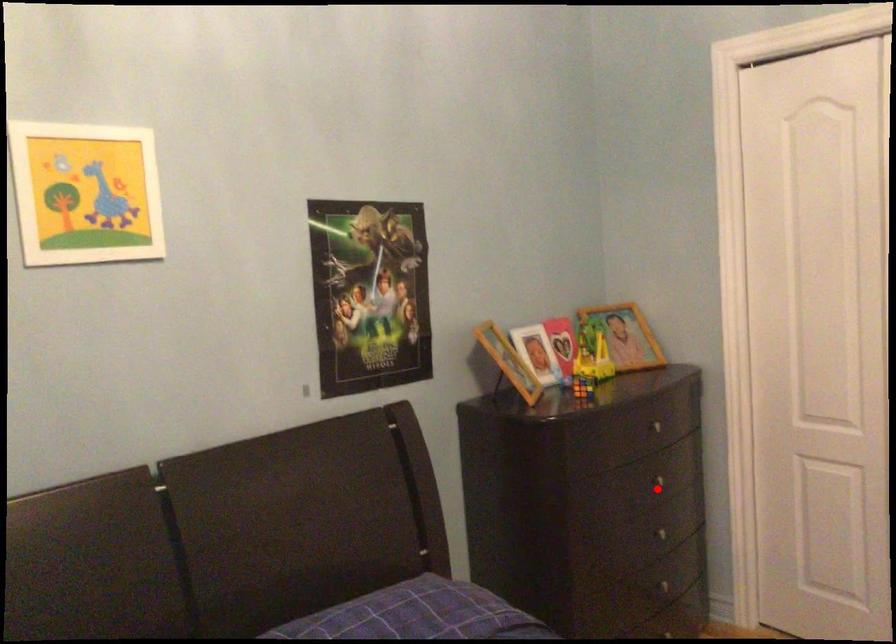
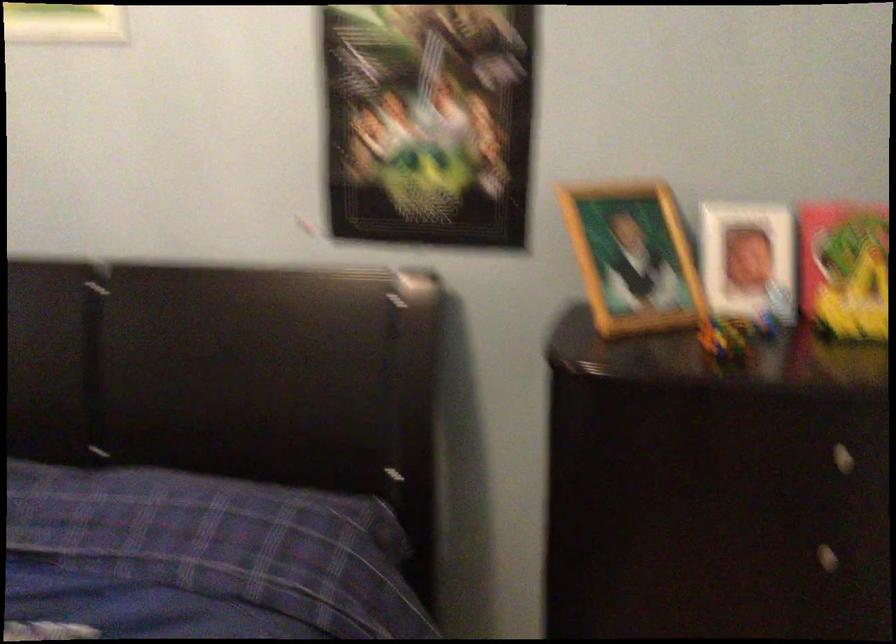
Question: I am providing you with two images of the same scene from different viewpoints. In image1, a red point is highlighted. Considering the same 3D point in image2, which of the following is correct?

Choices:
 (A) It is closer
 (B) It is farther

Answer: (A)